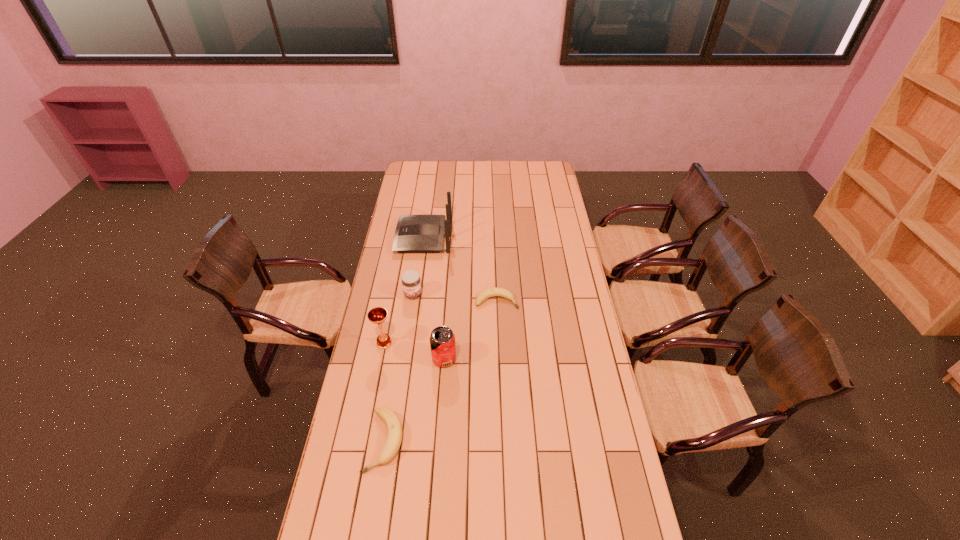
Where is `vacant region at the left edge of the desktop`? The width and height of the screenshot is (960, 540). vacant region at the left edge of the desktop is located at coordinates (408, 214).

This screenshot has width=960, height=540. Identify the location of free region at the right edge. (562, 338).

This screenshot has width=960, height=540. In order to click on free region at the near left corner of the desktop in this screenshot , I will do `click(374, 515)`.

This screenshot has width=960, height=540. Identify the location of vacant space at the far right corner. (539, 178).

This screenshot has width=960, height=540. In order to click on free space at the near right corner of the desktop in this screenshot , I will do `click(585, 504)`.

Locate an element on the screen. This screenshot has height=540, width=960. free space between the chalice and the farther banana is located at coordinates (441, 322).

Find the location of a particular element. This screenshot has height=540, width=960. free area in between the taller banana and the chalice is located at coordinates (385, 392).

This screenshot has height=540, width=960. Identify the location of empty space that is in between the fourth shortest object and the left banana. (415, 400).

The image size is (960, 540). Identify the location of free space that is in between the nearer banana and the third tallest object. (415, 400).

Image resolution: width=960 pixels, height=540 pixels. I want to click on free space between the third shortest object and the farthest object, so click(419, 266).